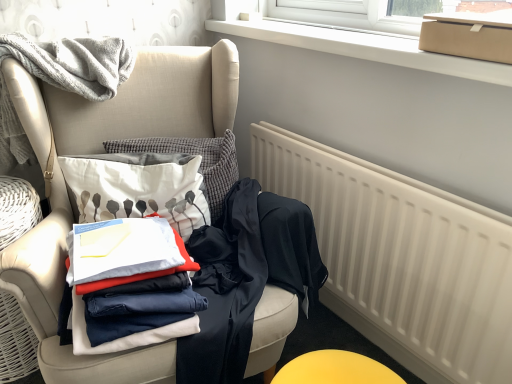
Question: Is matte beige armchair at left at the right side of dark blue fabric pants at center, acting as the 2th clothing starting from the left?

Choices:
 (A) yes
 (B) no

Answer: (B)

Question: Can you confirm if matte beige armchair at left is smaller than dark blue fabric pants at center, placed as the 2th clothing when sorted from right to left?

Choices:
 (A) no
 (B) yes

Answer: (A)

Question: Is matte beige armchair at left completely or partially outside of dark blue fabric pants at center, placed as the 2th clothing when sorted from right to left?

Choices:
 (A) yes
 (B) no

Answer: (A)

Question: Is matte beige armchair at left positioned with its back to dark blue fabric pants at center, placed as the 2th clothing when sorted from right to left?

Choices:
 (A) yes
 (B) no

Answer: (B)

Question: Is the depth of matte beige armchair at left less than that of dark blue fabric pants at center, acting as the 2th clothing starting from the left?

Choices:
 (A) yes
 (B) no

Answer: (A)

Question: Visually, is matte beige armchair at left positioned to the left or to the right of white matte radiator at lower right?

Choices:
 (A) left
 (B) right

Answer: (A)

Question: From a real-world perspective, is matte beige armchair at left physically located above or below white matte radiator at lower right?

Choices:
 (A) below
 (B) above

Answer: (B)

Question: In terms of width, does matte beige armchair at left look wider or thinner when compared to white matte radiator at lower right?

Choices:
 (A) wide
 (B) thin

Answer: (A)

Question: Based on their sizes in the image, would you say matte beige armchair at left is bigger or smaller than white matte radiator at lower right?

Choices:
 (A) big
 (B) small

Answer: (A)

Question: In terms of height, does white plastic window frame at upper center look taller or shorter compared to white matte radiator at lower right?

Choices:
 (A) short
 (B) tall

Answer: (A)

Question: Would you say white plastic window frame at upper center is inside or outside white matte radiator at lower right?

Choices:
 (A) inside
 (B) outside

Answer: (B)

Question: Based on their sizes in the image, would you say white plastic window frame at upper center is bigger or smaller than white matte radiator at lower right?

Choices:
 (A) small
 (B) big

Answer: (A)

Question: Considering the positions of white plastic window frame at upper center and white matte radiator at lower right in the image, is white plastic window frame at upper center wider or thinner than white matte radiator at lower right?

Choices:
 (A) thin
 (B) wide

Answer: (B)

Question: Is point (420, 33) positioned closer to the camera than point (251, 261)?

Choices:
 (A) farther
 (B) closer

Answer: (B)

Question: In the image, is matte cardboard box at upper right on the left side or the right side of dark blue fabric pants at center, placed as the 2th clothing when sorted from right to left?

Choices:
 (A) left
 (B) right

Answer: (B)